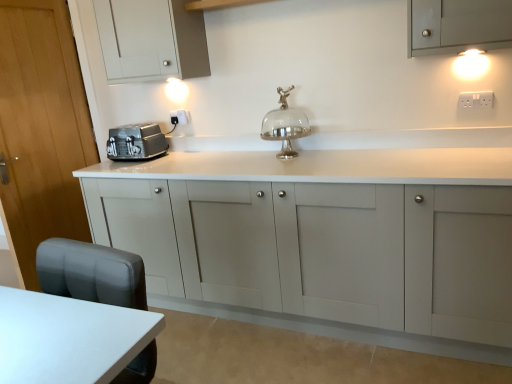
Question: Is wooden door at left to the left or to the right of matte white cabinet at upper left, the second cabinetry from the bottom, in the image?

Choices:
 (A) right
 (B) left

Answer: (B)

Question: In terms of width, does wooden door at left look wider or thinner when compared to matte white cabinet at upper left, arranged as the first cabinetry when viewed from the top?

Choices:
 (A) wide
 (B) thin

Answer: (B)

Question: Estimate the real-world distances between objects in this image. Which object is farther from the wooden door at left?

Choices:
 (A) white plastic electric outlet at upper center, placed as the second electric outlet when sorted from right to left
 (B) satin silver toaster at left
 (C) matte gray cabinet at center, positioned as the 1th cabinetry in bottom-to-top order
 (D) matte white cabinet at upper left, the second cabinetry from the bottom
 (E) white glossy table at lower left

Answer: (E)

Question: Which of these objects is positioned closest to the white plastic electric outlet at upper center, which is counted as the 1th electric outlet, starting from the left?

Choices:
 (A) white glossy table at lower left
 (B) matte gray cabinet at center, the 2th cabinetry viewed from the top
 (C) matte white cabinet at upper left, arranged as the first cabinetry when viewed from the top
 (D) silver metallic cake stand at center
 (E) wooden door at left

Answer: (C)